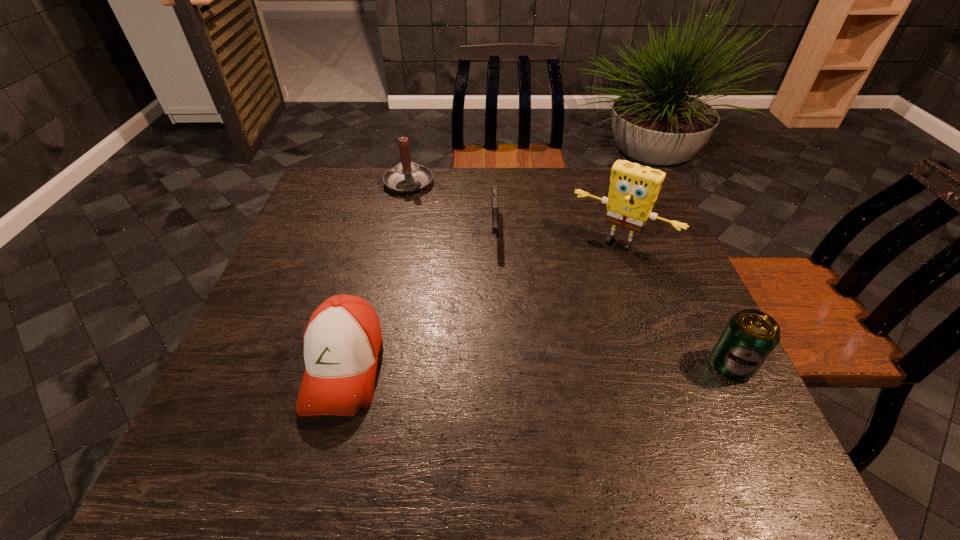
Find the location of a particular element. The image size is (960, 540). vacant space at the far left corner of the desktop is located at coordinates (324, 191).

In the image, there is a desktop. What are the coordinates of `vacant area at the far right corner` in the screenshot? It's located at (606, 195).

The image size is (960, 540). Find the location of `vacant space at the near right corner of the desktop`. vacant space at the near right corner of the desktop is located at coordinates (704, 389).

The width and height of the screenshot is (960, 540). Find the location of `free space that is in between the farthest object and the sponge`. free space that is in between the farthest object and the sponge is located at coordinates (514, 213).

Locate an element on the screen. free spot between the candle and the gun is located at coordinates (451, 205).

Where is `vacant point located between the tallest object and the shortest object`? vacant point located between the tallest object and the shortest object is located at coordinates (557, 234).

This screenshot has height=540, width=960. I want to click on empty space that is in between the shortest object and the baseball cap, so click(420, 297).

Locate an element on the screen. free area in between the beer can and the gun is located at coordinates pos(613,296).

I want to click on free spot between the beer can and the shortest object, so click(x=613, y=296).

At what (x,y) coordinates should I click in order to perform the action: click on vacant region between the baseball cap and the farthest object. Please return your answer as a coordinate pair (x, y). Looking at the image, I should click on (376, 275).